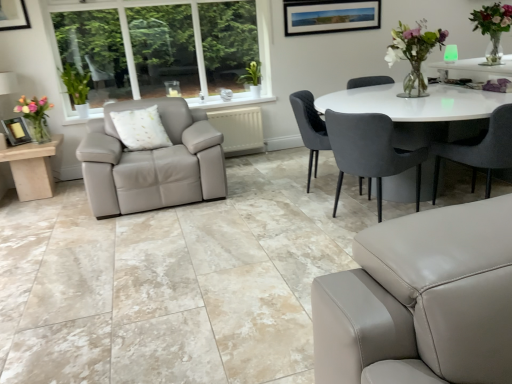
Locate an element on the screen. Image resolution: width=512 pixels, height=384 pixels. vacant area situated below velvet dark gray chair at center, which ranks as the second chair in left-to-right order (from a real-world perspective) is located at coordinates (356, 215).